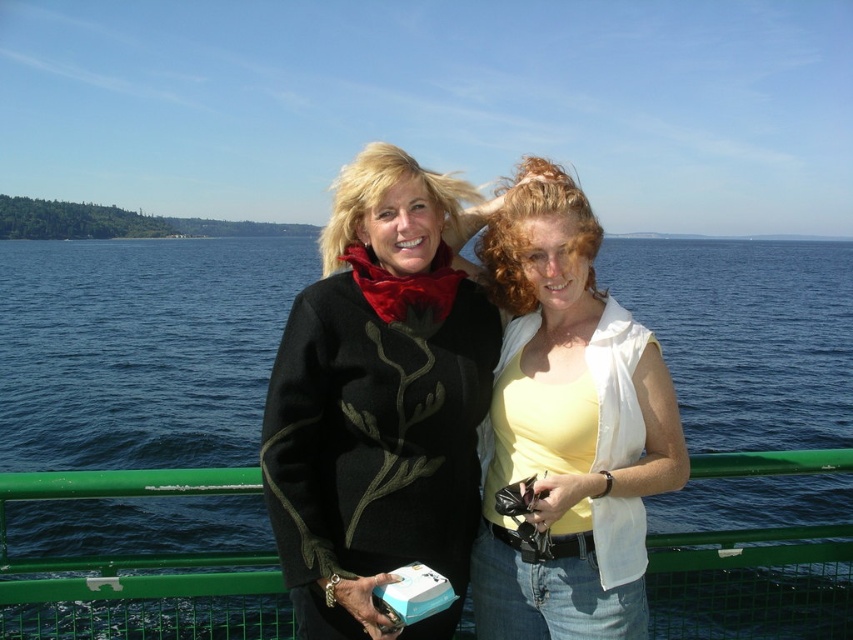
Question: Does blue water at center have a smaller size compared to green metal railing at center?

Choices:
 (A) yes
 (B) no

Answer: (B)

Question: Is black woolen sweater at center below yellow matte tank top at center?

Choices:
 (A) no
 (B) yes

Answer: (A)

Question: Which object appears farthest from the camera in this image?

Choices:
 (A) black woolen sweater at center
 (B) yellow matte tank top at center
 (C) blue water at center
 (D) green metal railing at center

Answer: (B)

Question: Is blue water at center thinner than black woolen sweater at center?

Choices:
 (A) no
 (B) yes

Answer: (A)

Question: Based on their relative distances, which object is nearer to the green metal railing at center?

Choices:
 (A) yellow matte tank top at center
 (B) black woolen sweater at center

Answer: (A)

Question: Which point is farther to the camera?

Choices:
 (A) (573, 422)
 (B) (669, 593)
 (C) (447, 484)
 (D) (265, 529)

Answer: (D)